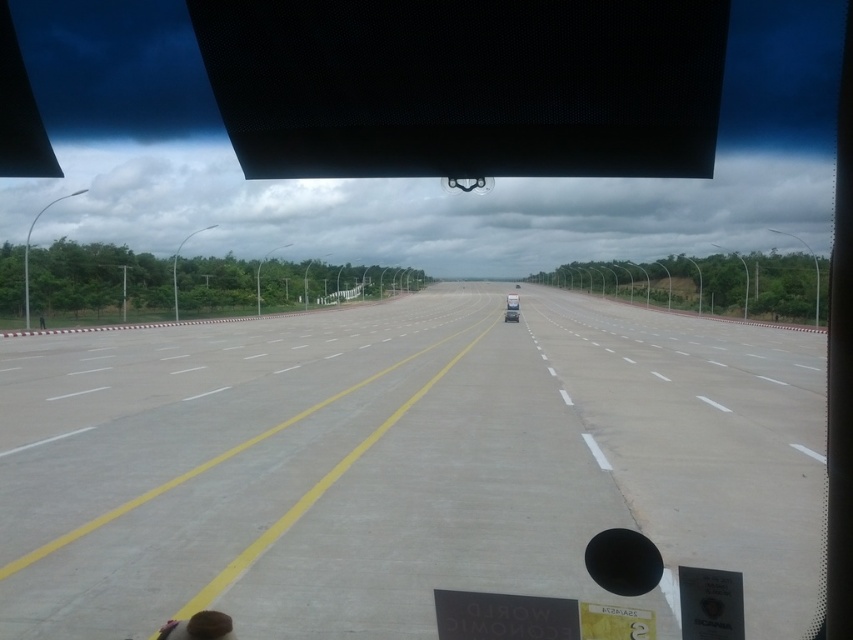
You are driving a car and want to know if you can safely stop before reaching the point at coordinates point (132, 419). Your current speed is 40 mph and your car can decelerate at 0.8 g. Can you stop in time?

The distance between the car and point (132, 419) is 37.66 feet. To determine if you can stop in time, calculate the braking distance using the formula d equals v squared over 2a, where v is speed in feet per second and a is acceleration in feet per second squared. Converting 40 mph to feet per second gives approximately 58.67 ft per second. Plugging into the formula, d equals 58.67 squared divided by 2 times 26. Let me compute that. 58.67 squared is about 3,442. Then divided by 52 gives around 66.2 feet.

You are driving a car and see the image. There is a concrete at center and a white glossy car at center. Which object is closer to you?

The concrete at center is closer to you because it is in front of the white glossy car at center.